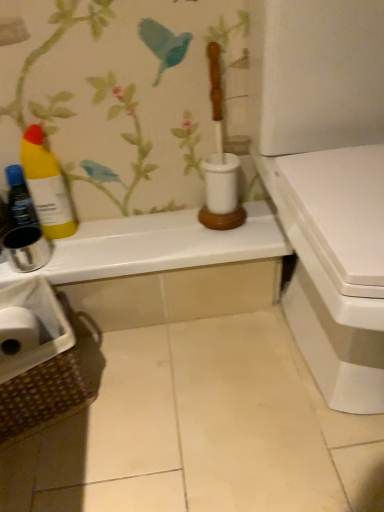
At what (x,y) coordinates should I click in order to perform the action: click on blank space above white glossy counter top at upper center (from a real-world perspective). Please return your answer as a coordinate pair (x, y). Looking at the image, I should click on (148, 231).